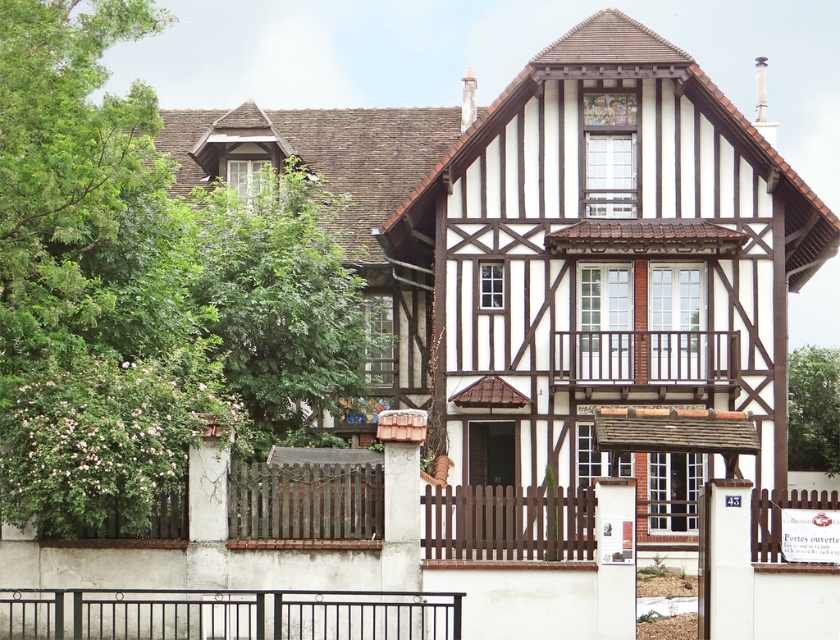
You are standing in the front yard of the house and notice the green leafy tree at upper left and the black metal fence at lower center. Which object is located higher up in the image?

The green leafy tree at upper left is positioned over the black metal fence at lower center, so it is higher up in the image.